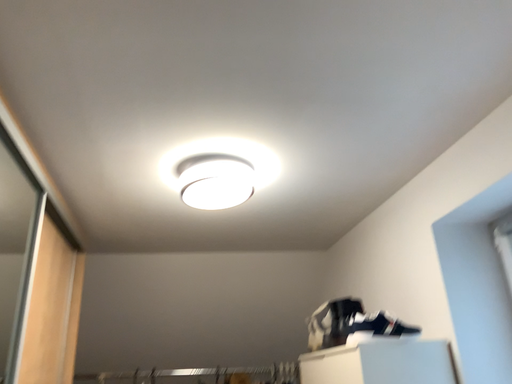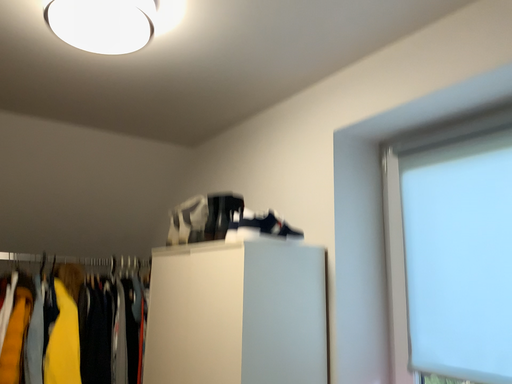
Question: Which way did the camera rotate in the video?

Choices:
 (A) rotated downward
 (B) rotated upward

Answer: (A)